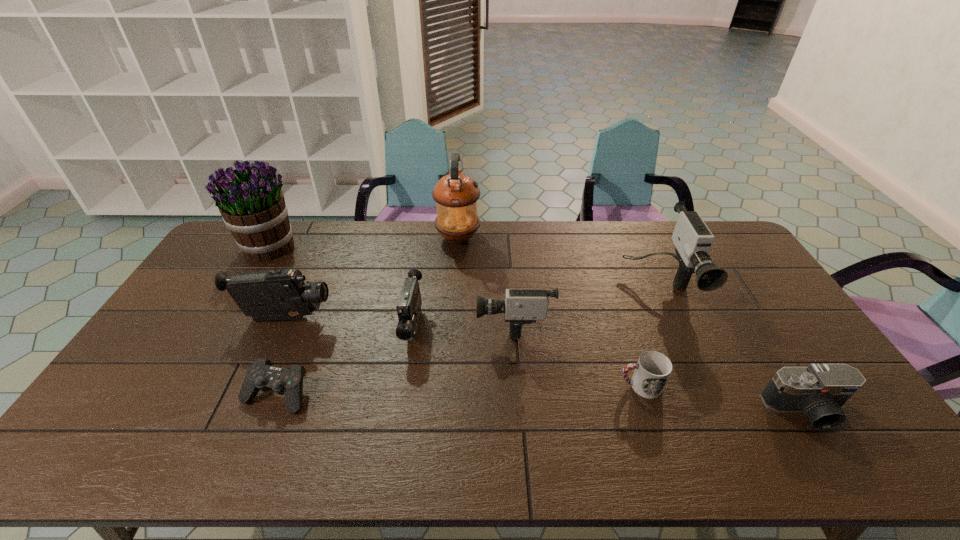
Locate an element on the screen. This screenshot has height=540, width=960. free space located on the recording direction of the second camcorder from right to left is located at coordinates (355, 323).

Find the location of a particular element. Image resolution: width=960 pixels, height=540 pixels. vacant space located 0.340m on the recording direction of the second camcorder from right to left is located at coordinates (366, 323).

Find the location of `free space located on the front-facing side of the second camcorder from left to right`. free space located on the front-facing side of the second camcorder from left to right is located at coordinates (400, 408).

The image size is (960, 540). I want to click on free space located 0.050m on the front-facing side of the black camera, so click(x=832, y=452).

Image resolution: width=960 pixels, height=540 pixels. I want to click on free space located 0.270m on the handle side of the third object from right to left, so click(517, 386).

I want to click on free location located on the handle side of the third object from right to left, so click(x=491, y=386).

The width and height of the screenshot is (960, 540). I want to click on vacant area situated 0.060m on the handle side of the third object from right to left, so click(x=596, y=386).

Where is `vacant space located 0.380m on the back of the shortest object`? vacant space located 0.380m on the back of the shortest object is located at coordinates [x=322, y=281].

At what (x,y) coordinates should I click in order to perform the action: click on oil lamp situated at the far edge. Please return your answer as a coordinate pair (x, y). This screenshot has height=540, width=960. Looking at the image, I should click on (456, 195).

The image size is (960, 540). Find the location of `bouquet present at the far edge`. bouquet present at the far edge is located at coordinates (252, 205).